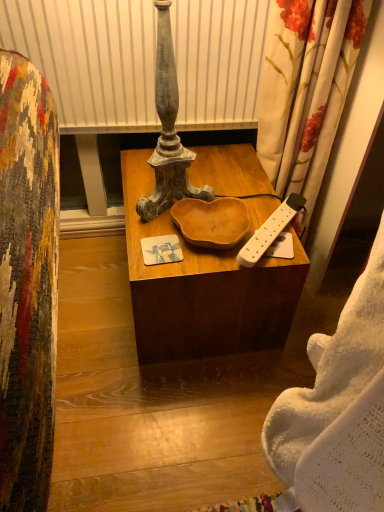
Find the location of `free point above wooden bowl at center (from a real-world perspective)`. free point above wooden bowl at center (from a real-world perspective) is located at coordinates (218, 192).